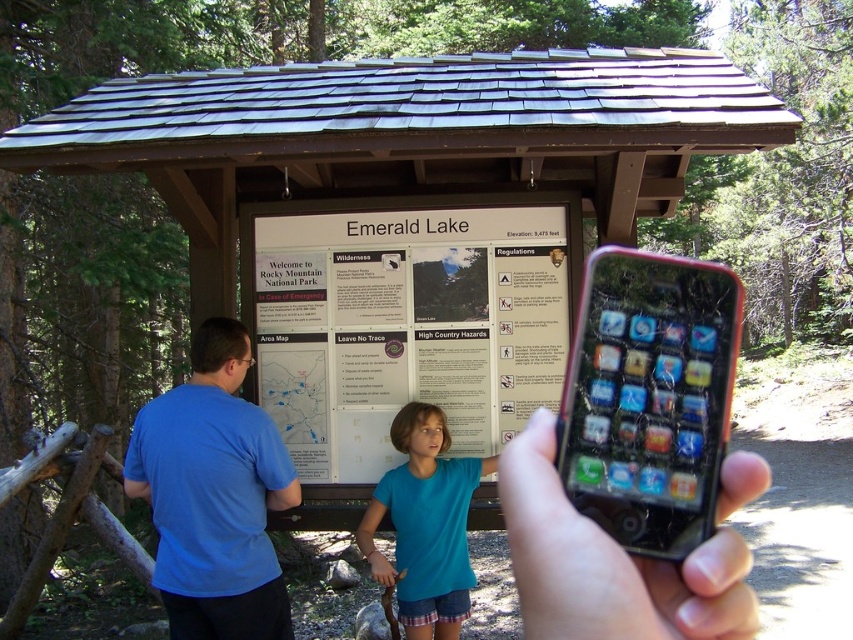
Question: Which of the following is the closest to the observer?

Choices:
 (A) (437, 440)
 (B) (175, 474)
 (C) (749, 624)

Answer: (C)

Question: Is transparent plastic phone at center positioned behind blue cotton shirt at center?

Choices:
 (A) yes
 (B) no

Answer: (B)

Question: Is blue cotton shirt at left behind transparent plastic phone at center?

Choices:
 (A) no
 (B) yes

Answer: (B)

Question: Can you confirm if blue cotton shirt at left is wider than blue cotton shirt at center?

Choices:
 (A) yes
 (B) no

Answer: (A)

Question: Which point is closer to the camera?

Choices:
 (A) (664, 394)
 (B) (300, 456)
 (C) (399, 602)
 (D) (231, 355)

Answer: (A)

Question: Among these objects, which one is nearest to the camera?

Choices:
 (A) white paper sign at center
 (B) blue cotton shirt at center
 (C) blue cotton shirt at left

Answer: (C)